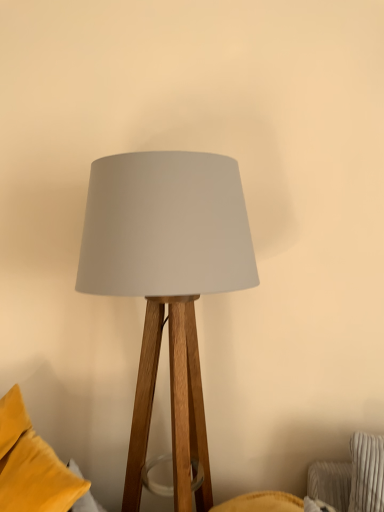
This screenshot has width=384, height=512. What do you see at coordinates (167, 283) in the screenshot?
I see `matte wood lamp at center` at bounding box center [167, 283].

In order to click on matte wood lamp at center in this screenshot , I will do `click(167, 283)`.

Where is `velvet yellow pillow at lower left`? The image size is (384, 512). velvet yellow pillow at lower left is located at coordinates (31, 465).

The image size is (384, 512). What do you see at coordinates (31, 465) in the screenshot?
I see `velvet yellow pillow at lower left` at bounding box center [31, 465].

What is the approximate width of velvet yellow pillow at lower left?

velvet yellow pillow at lower left is 15.43 inches wide.

Where is `matte wood lamp at center`? This screenshot has width=384, height=512. matte wood lamp at center is located at coordinates (167, 283).

In the scene shown: Between matte wood lamp at center and velvet yellow pillow at lower left, which one appears on the left side from the viewer's perspective?

From the viewer's perspective, velvet yellow pillow at lower left appears more on the left side.

Between matte wood lamp at center and velvet yellow pillow at lower left, which one is positioned in front?

velvet yellow pillow at lower left.

Is point (143, 221) behind point (2, 446)?

No, (143, 221) is in front of (2, 446).

From the image's perspective, is matte wood lamp at center located above velvet yellow pillow at lower left?

Correct, matte wood lamp at center appears higher than velvet yellow pillow at lower left in the image.

From a real-world perspective, relative to velvet yellow pillow at lower left, is matte wood lamp at center vertically above or below?

Clearly, from a real-world perspective, matte wood lamp at center is above velvet yellow pillow at lower left.

Can you confirm if matte wood lamp at center is wider than velvet yellow pillow at lower left?

Yes.

Which of these two, matte wood lamp at center or velvet yellow pillow at lower left, stands taller?

Standing taller between the two is matte wood lamp at center.

Who is smaller, matte wood lamp at center or velvet yellow pillow at lower left?

Smaller between the two is velvet yellow pillow at lower left.

Is velvet yellow pillow at lower left completely or partially inside matte wood lamp at center?

No.

Is matte wood lamp at center beside velvet yellow pillow at lower left?

No, matte wood lamp at center is not in contact with velvet yellow pillow at lower left.

Is matte wood lamp at center facing towards velvet yellow pillow at lower left?

No.

The height and width of the screenshot is (512, 384). Find the location of `lamp on the right of velvet yellow pillow at lower left`. lamp on the right of velvet yellow pillow at lower left is located at coordinates (167, 283).

Does velvet yellow pillow at lower left appear on the left side of matte wood lamp at center?

Indeed, velvet yellow pillow at lower left is positioned on the left side of matte wood lamp at center.

Which is in front, velvet yellow pillow at lower left or matte wood lamp at center?

velvet yellow pillow at lower left is more forward.

Which is less distant, (x=70, y=497) or (x=198, y=511)?

Point (x=70, y=497) is positioned closer to the camera compared to point (x=198, y=511).

From the image's perspective, relative to matte wood lamp at center, is velvet yellow pillow at lower left above or below?

Based on their image positions, velvet yellow pillow at lower left is located beneath matte wood lamp at center.

From a real-world perspective, does velvet yellow pillow at lower left sit lower than matte wood lamp at center?

Indeed, from a real-world perspective, velvet yellow pillow at lower left is positioned beneath matte wood lamp at center.

Is velvet yellow pillow at lower left wider or thinner than matte wood lamp at center?

Considering their sizes, velvet yellow pillow at lower left looks slimmer than matte wood lamp at center.

Who is shorter, velvet yellow pillow at lower left or matte wood lamp at center?

With less height is velvet yellow pillow at lower left.

Who is bigger, velvet yellow pillow at lower left or matte wood lamp at center?

matte wood lamp at center.

Is velvet yellow pillow at lower left completely or partially outside of matte wood lamp at center?

velvet yellow pillow at lower left lies outside matte wood lamp at center's area.

Is velvet yellow pillow at lower left directly adjacent to matte wood lamp at center?

velvet yellow pillow at lower left is not next to matte wood lamp at center, and they're not touching.

Is velvet yellow pillow at lower left looking in the opposite direction of matte wood lamp at center?

No, velvet yellow pillow at lower left's orientation is not away from matte wood lamp at center.

What's the angular difference between velvet yellow pillow at lower left and matte wood lamp at center's facing directions?

They differ by 13 degrees in their facing directions.

Locate an element on the screen. The height and width of the screenshot is (512, 384). pillow in front of the matte wood lamp at center is located at coordinates (31, 465).

You are a GUI agent. You are given a task and a screenshot of the screen. Output one action in this format:
    pyautogui.click(x=<x>, y=<y>)
    Task: Click on the pillow that appears below the matte wood lamp at center (from a real-world perspective)
    This screenshot has width=384, height=512.
    Given the screenshot: What is the action you would take?
    pyautogui.click(x=31, y=465)

You are a GUI agent. You are given a task and a screenshot of the screen. Output one action in this format:
    pyautogui.click(x=<x>, y=<y>)
    Task: Click on the lamp above the velvet yellow pillow at lower left (from a real-world perspective)
    This screenshot has height=512, width=384.
    Given the screenshot: What is the action you would take?
    pos(167,283)